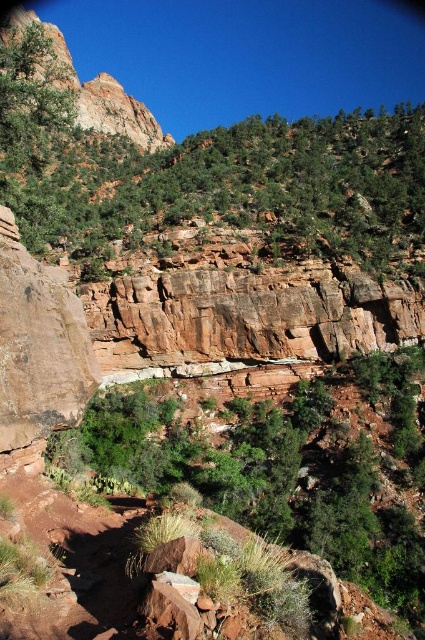
Question: Is green leafy shrubs at center smaller than rustic rock formation at upper left?

Choices:
 (A) no
 (B) yes

Answer: (B)

Question: Which of the following is the farthest from the observer?

Choices:
 (A) (79, 104)
 (B) (394, 545)

Answer: (A)

Question: Can you confirm if green leafy trees at upper center is positioned below rustic rock formation at upper left?

Choices:
 (A) no
 (B) yes

Answer: (B)

Question: Is green leafy trees at upper center to the right of green leafy shrubs at center from the viewer's perspective?

Choices:
 (A) yes
 (B) no

Answer: (A)

Question: Which point appears closest to the camera in this image?

Choices:
 (A) (302, 438)
 (B) (53, 45)

Answer: (A)

Question: Which point is closer to the camera taking this photo?

Choices:
 (A) (317, 552)
 (B) (155, 147)

Answer: (A)